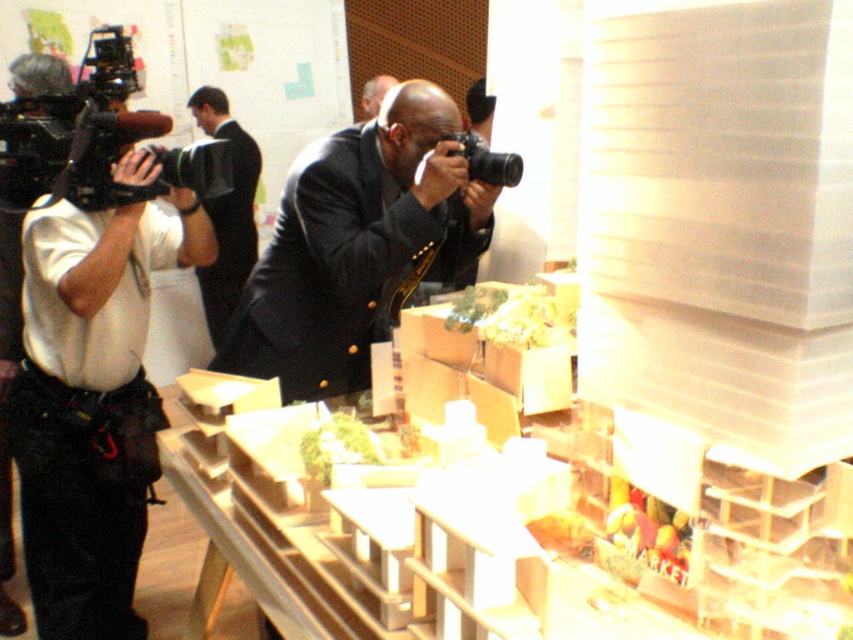
Question: Based on their relative distances, which object is nearer to the dark gray suit at center?

Choices:
 (A) black plastic video camera at upper left
 (B) black suit at upper left
 (C) black plastic camera at center
 (D) green leafy vegetables at center

Answer: (C)

Question: Which object is positioned closest to the black plastic video camera at upper left?

Choices:
 (A) green leafy vegetable at center
 (B) green leafy vegetables at center

Answer: (B)

Question: Does black plastic video camera at upper left have a larger size compared to green leafy vegetable at center?

Choices:
 (A) yes
 (B) no

Answer: (A)

Question: Which point is farther to the camera?

Choices:
 (A) green leafy vegetable at center
 (B) black plastic video camera at upper left

Answer: (B)

Question: Does white shirt at left come in front of green leafy vegetables at center?

Choices:
 (A) no
 (B) yes

Answer: (A)

Question: Can you confirm if black suit at upper left is positioned above black plastic camera at center?

Choices:
 (A) no
 (B) yes

Answer: (B)